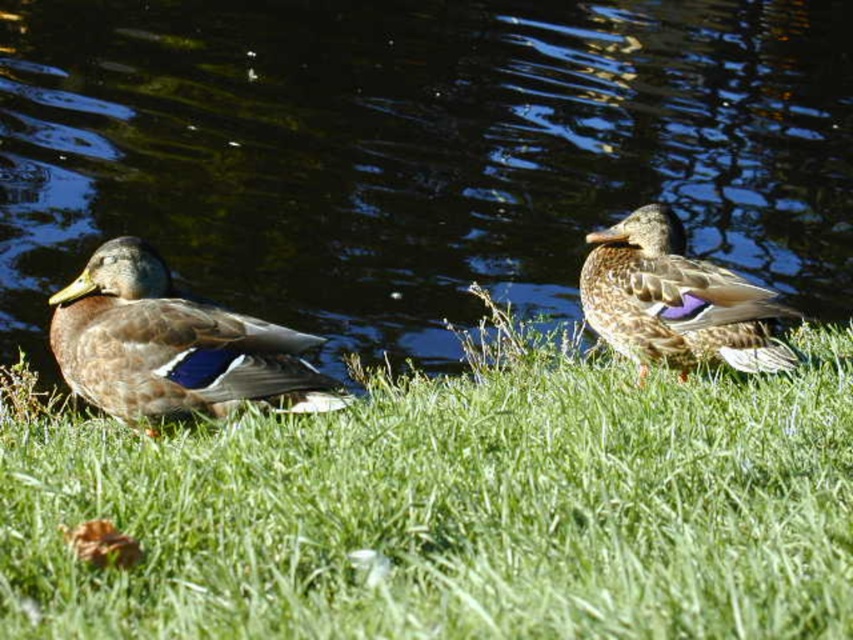
Question: Where is dark reflective water at center located in relation to brown feathered duck at center in the image?

Choices:
 (A) below
 (B) above

Answer: (B)

Question: Which object appears closest to the camera in this image?

Choices:
 (A) brown feathered duck at center
 (B) brown matte duck at left
 (C) green grassy at lower center

Answer: (C)

Question: Is green grassy at lower center further to the viewer compared to brown matte duck at left?

Choices:
 (A) yes
 (B) no

Answer: (B)

Question: Considering the real-world distances, which object is farthest from the brown matte duck at left?

Choices:
 (A) brown feathered duck at center
 (B) dark reflective water at center

Answer: (B)

Question: In this image, where is green grassy at lower center located relative to brown feathered duck at center?

Choices:
 (A) above
 (B) below

Answer: (B)

Question: Which object appears closest to the camera in this image?

Choices:
 (A) green grassy at lower center
 (B) brown matte duck at left
 (C) brown feathered duck at center

Answer: (A)